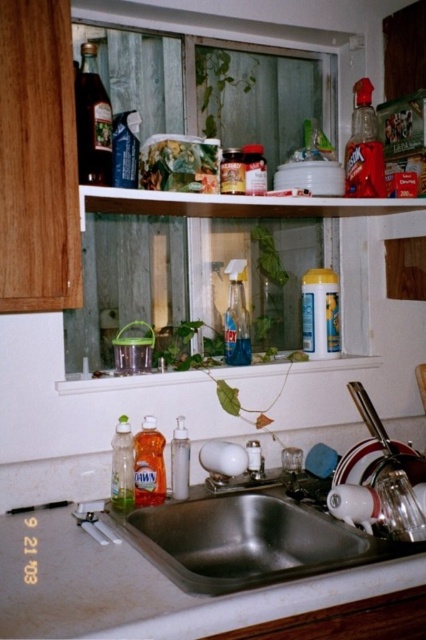
You are organizing the kitchen items and need to place a new item between the translucent plastic dish soap at sink left and the translucent plastic jar at center. Based on their positions, where should you place the new item?

Since the translucent plastic dish soap at sink left is to the left of the translucent plastic jar at center, you should place the new item between them, to the right of the dish soap and to the left of the jar.

You need to choose between the translucent plastic dish soap at sink left and the translucent plastic jar at center to place a small decorative item on top. Which one can support the item better based on their heights?

The translucent plastic dish soap at sink left has a greater height compared to the translucent plastic jar at center, so it can support the item better as it provides a more stable base.

You are standing in the kitchen and want to reach both the point at coordinates (244, 364) and the point at coordinates (241, 161). Which point will you reach first?

You will reach point (244, 364) first because it is closer to you than point (241, 161), which is further away.